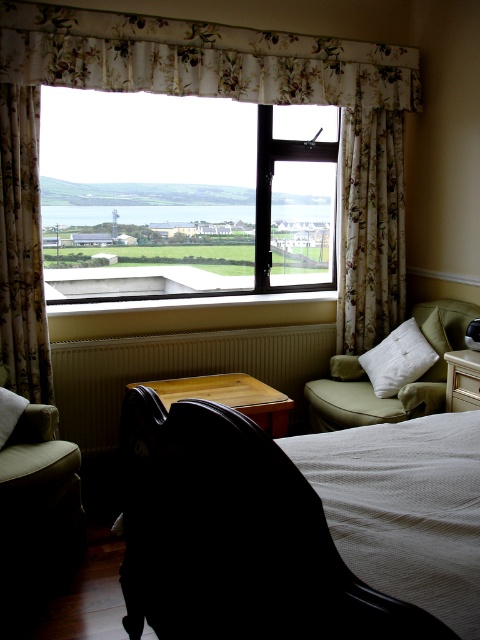
Which is above, wooden/radiant at lower center or floral fabric curtain at left?

floral fabric curtain at left is higher up.

Is point (222, 349) positioned after point (32, 362)?

Yes, it is behind point (32, 362).

Is point (332, 349) positioned before point (35, 204)?

No.

Identify the location of wooden/radiant at lower center. The height and width of the screenshot is (640, 480). (178, 371).

Does floral fabric curtain at left have a greater height compared to leather couch at lower left?

Correct, floral fabric curtain at left is much taller as leather couch at lower left.

Is point (31, 141) less distant than point (48, 522)?

No.

Identify the location of floral fabric curtain at left. (22, 248).

Measure the distance from leather couch at lower left to white textured pillow at right.

A distance of 2.00 meters exists between leather couch at lower left and white textured pillow at right.

Is leather couch at lower left bigger than white textured pillow at right?

Yes, leather couch at lower left is bigger than white textured pillow at right.

Locate an element on the screen. leather couch at lower left is located at coordinates (38, 492).